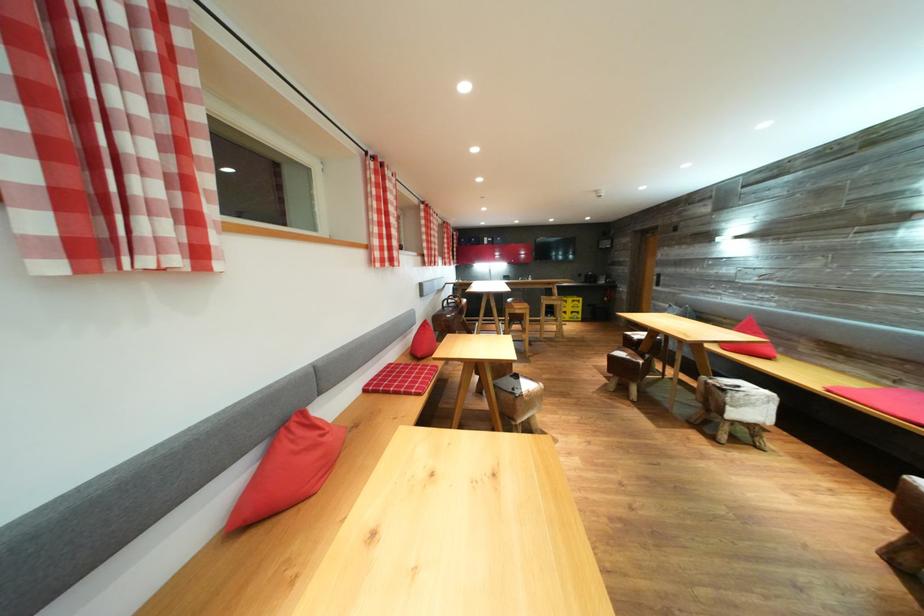
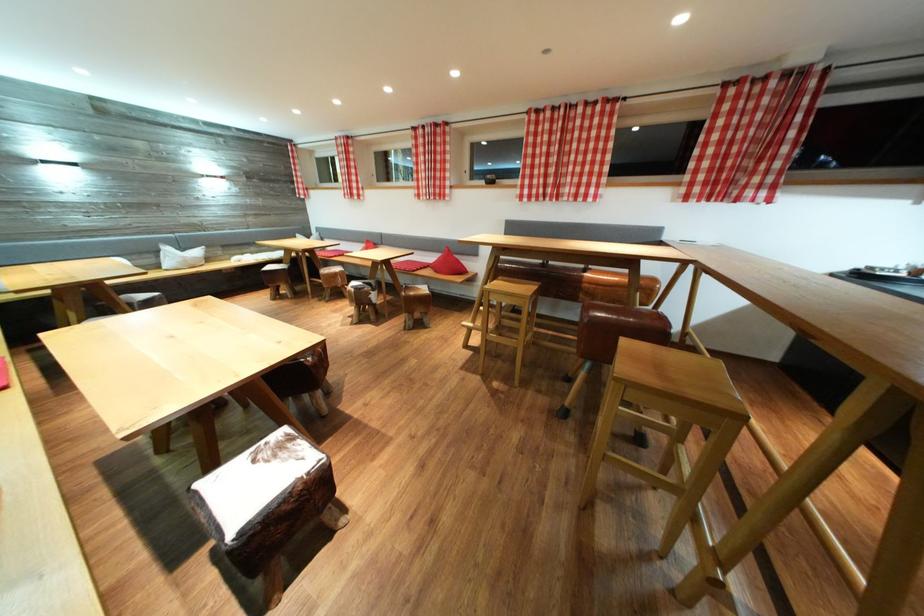
Question: I am providing you with two images of the same scene from different viewpoints. After the viewpoint changes to image2, which objects are now occluded?

Choices:
 (A) stool sitting surface
 (B) light wood stool
 (C) sofa sitting surface
 (D) red tube

Answer: (A)